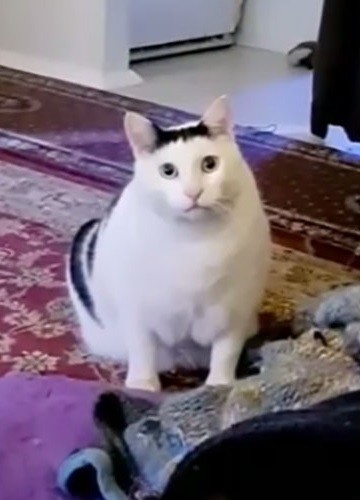
I want to click on wall, so click(x=84, y=35).